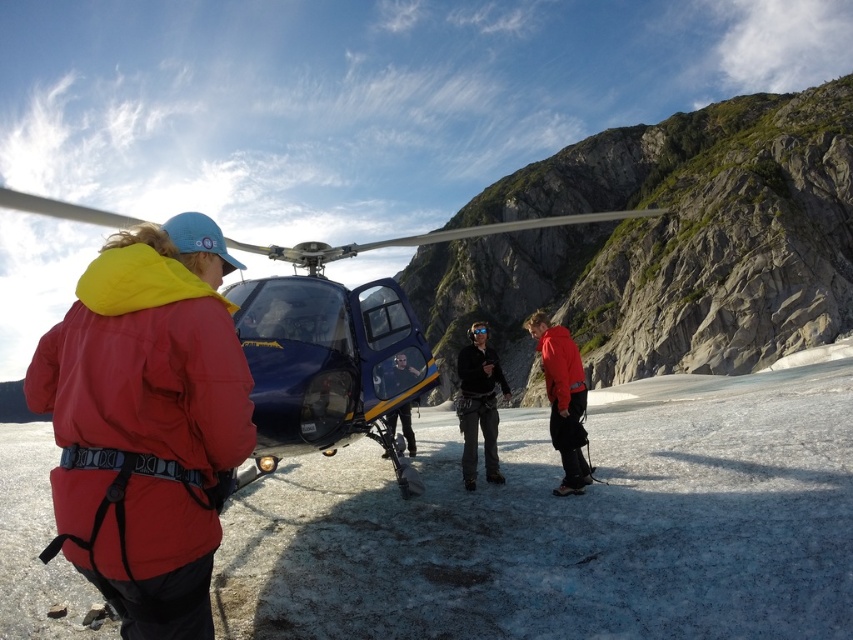
Can you confirm if red matte jacket at center is taller than black matte jacket at center?

Yes.

Is point (582, 476) closer to camera compared to point (489, 369)?

Yes, it is in front of point (489, 369).

What are the coordinates of `red matte jacket at center` in the screenshot? It's located at (563, 397).

Is red matte jacket at center further to camera compared to matte black helmet at center?

Yes, red matte jacket at center is further from the viewer.

Measure the distance between red matte jacket at center and camera.

red matte jacket at center is 128.71 feet away from camera.

Is point (544, 364) farther from viewer compared to point (418, 371)?

Yes, point (544, 364) is behind point (418, 371).

You are a GUI agent. You are given a task and a screenshot of the screen. Output one action in this format:
    pyautogui.click(x=<x>, y=<y>)
    Task: Click on the red matte jacket at center
    The width and height of the screenshot is (853, 640).
    Given the screenshot: What is the action you would take?
    pyautogui.click(x=563, y=397)

Who is more distant from viewer, (x=228, y=333) or (x=583, y=403)?

Positioned behind is point (x=583, y=403).

Does point (149, 445) come behind point (582, 488)?

That is False.

Is point (229, 266) closer to viewer compared to point (575, 387)?

Yes, point (229, 266) is closer to viewer.

At what (x,y) coordinates should I click in order to perform the action: click on matte red jacket at left. Please return your answer as a coordinate pair (x, y). This screenshot has width=853, height=640. Looking at the image, I should click on (146, 420).